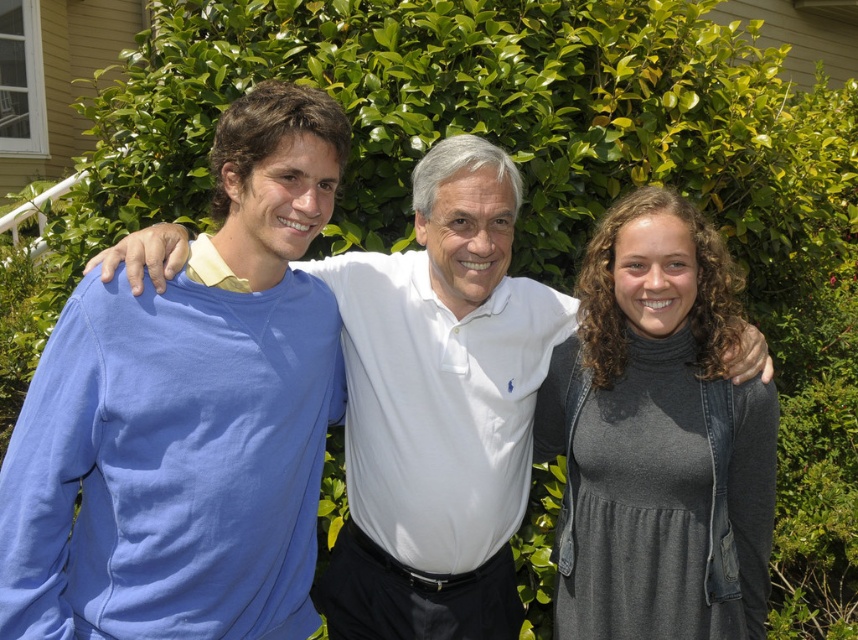
You are a photographer setting up a photo shoot in a garden. You have two outfits to choose from for the main character. The first is the blue cotton shirt at left, and the second is the gray matte dress at center. The client wants the outfit to be as large as possible to stand out in the image. Which outfit should you select?

The blue cotton shirt at left is bigger than the gray matte dress at center, so you should select the blue cotton shirt at left to make the outfit as large as possible for better visibility in the image.

You are a photographer standing in front of the three people in the image. You want to take a photo of the blue cotton shirt at left without including the other two people. Can you step back to achieve this?

The blue cotton shirt at left is 2.06 meters away from the camera. Since the other two people are standing close to the blue cotton shirt at left, stepping back might include them in the frame. To exclude them, you need to move sideways or adjust the camera angle instead of stepping back.

You are standing in front of the three people in the image. You want to place a small gift exactly at the point with coordinates point (x=188, y=417). Which person should you give the gift to?

The point (x=188, y=417) is on the blue cotton shirt at left, so you should give the gift to the person on the left wearing the light blue long sleeved shirt.